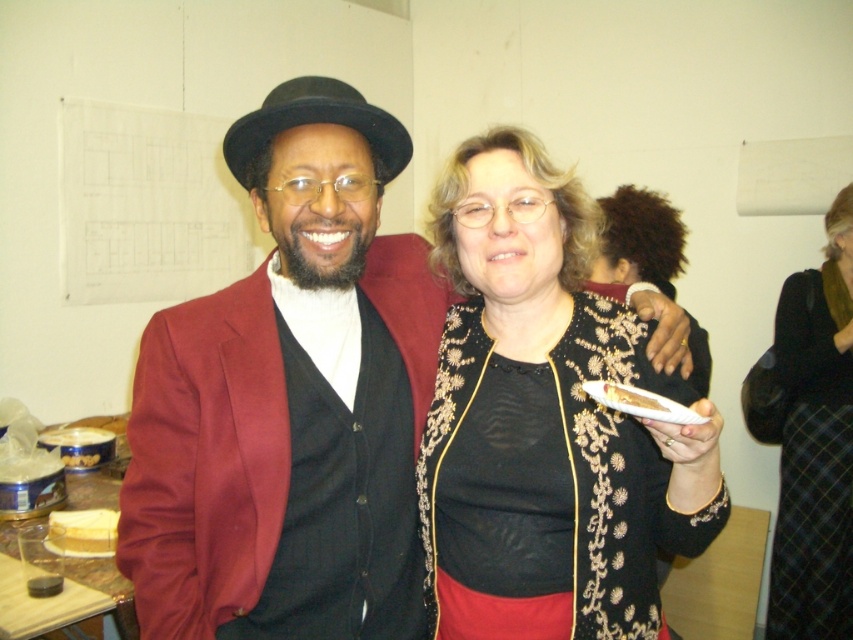
Between shiny black hat at center and black embroidered jacket at center, which one is positioned lower?

Positioned lower is shiny black hat at center.

Describe the element at coordinates (289, 400) in the screenshot. I see `shiny black hat at center` at that location.

Measure the distance between shiny black hat at center and camera.

A distance of 3.41 feet exists between shiny black hat at center and camera.

This screenshot has height=640, width=853. Identify the location of shiny black hat at center. (289, 400).

Does shiny black hat at center come in front of black woolen skirt at lower right?

Yes.

Is point (268, 563) positioned in front of point (780, 365)?

Yes, point (268, 563) is closer to viewer.

Identify the location of shiny black hat at center. This screenshot has width=853, height=640. (289, 400).

Between black embroidered jacket at center and black woolen skirt at lower right, which one is positioned higher?

black embroidered jacket at center is higher up.

Is point (485, 321) positioned behind point (804, 637)?

No, (485, 321) is closer to viewer.

Between point (624, 333) and point (838, 529), which one is positioned in front?

Positioned in front is point (624, 333).

Image resolution: width=853 pixels, height=640 pixels. I want to click on black embroidered jacket at center, so click(x=544, y=420).